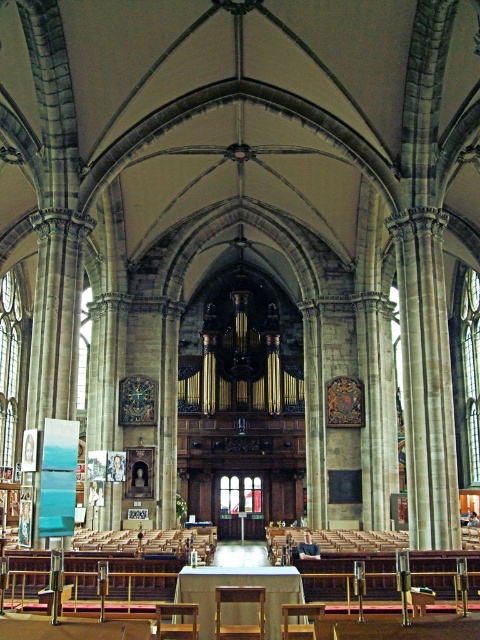
Question: Which of these objects is positioned farthest from the brown wooden chair at center?

Choices:
 (A) wooden chair at lower center
 (B) wooden chair at center

Answer: (B)

Question: Does wooden chair at lower center have a larger size compared to wooden chair at center?

Choices:
 (A) no
 (B) yes

Answer: (B)

Question: Can you confirm if brown wooden chair at center is smaller than wooden chair at lower center?

Choices:
 (A) yes
 (B) no

Answer: (A)

Question: Which of the following is the farthest from the observer?

Choices:
 (A) (252, 632)
 (B) (294, 604)
 (C) (189, 620)

Answer: (C)

Question: Considering the relative positions of wooden chair at lower center and wooden chair at center in the image provided, where is wooden chair at lower center located with respect to wooden chair at center?

Choices:
 (A) left
 (B) right

Answer: (A)

Question: Which object is closer to the camera taking this photo?

Choices:
 (A) wooden chair at lower center
 (B) brown wooden chair at center

Answer: (A)